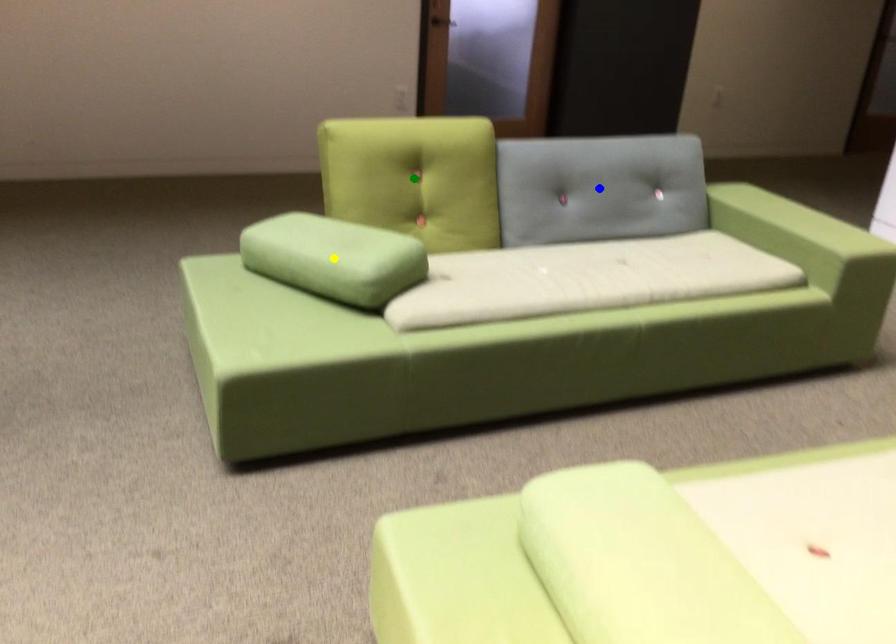
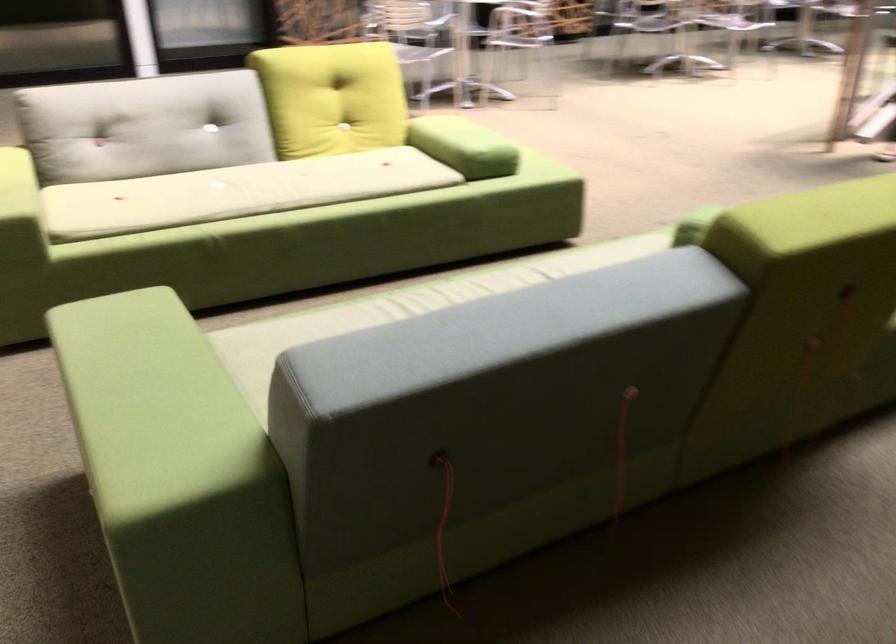
I am providing you with two images of the same scene from different viewpoints. Three points are marked in image1. Which point corresponds to a part or object that is occluded in image2?In image1, three points are marked. Which of them correspond to a part or object that is occluded in image2?Among the three points shown in image1, which one corresponds to a part or object that is no longer visible due to occlusion in image2?

green point, yellow point, blue point cannot be seen in image2.